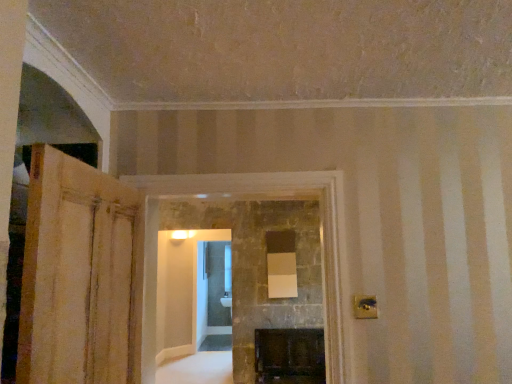
What is the approximate width of wooden door at left?

The width of wooden door at left is 3.49 inches.

I want to click on wooden door at left, so click(x=78, y=274).

Image resolution: width=512 pixels, height=384 pixels. What do you see at coordinates (78, 274) in the screenshot?
I see `wooden door at left` at bounding box center [78, 274].

This screenshot has height=384, width=512. Describe the element at coordinates (280, 199) in the screenshot. I see `dark stone fireplace at center` at that location.

Locate an element on the screen. dark stone fireplace at center is located at coordinates pos(280,199).

This screenshot has width=512, height=384. In order to click on wooden door at left in this screenshot , I will do `click(78, 274)`.

Considering the positions of objects dark stone fireplace at center and wooden door at left in the image provided, who is more to the left, dark stone fireplace at center or wooden door at left?

Positioned to the left is wooden door at left.

Is dark stone fireplace at center further to camera compared to wooden door at left?

Yes, the depth of dark stone fireplace at center is greater than that of wooden door at left.

Which is behind, point (341, 331) or point (115, 328)?

Point (341, 331)

From the image's perspective, between dark stone fireplace at center and wooden door at left, who is located below?

dark stone fireplace at center, from the image's perspective.

From a real-world perspective, is dark stone fireplace at center positioned above or below wooden door at left?

Clearly, from a real-world perspective, dark stone fireplace at center is above wooden door at left.

Which object is wider, dark stone fireplace at center or wooden door at left?

With larger width is dark stone fireplace at center.

Can you confirm if dark stone fireplace at center is shorter than wooden door at left?

Incorrect, the height of dark stone fireplace at center does not fall short of that of wooden door at left.

Based on the photo, who is smaller, dark stone fireplace at center or wooden door at left?

wooden door at left is smaller.

Is wooden door at left a part of dark stone fireplace at center?

No, wooden door at left is not a part of dark stone fireplace at center.

Is dark stone fireplace at center not near wooden door at left?

That's not correct — dark stone fireplace at center is a little close to wooden door at left.

Is dark stone fireplace at center facing away from wooden door at left?

No, wooden door at left is not at the back of dark stone fireplace at center.

What's the angular difference between dark stone fireplace at center and wooden door at left's facing directions?

There is a 86.1-degree angle between the facing directions of dark stone fireplace at center and wooden door at left.

Measure the distance between dark stone fireplace at center and wooden door at left.

The distance of dark stone fireplace at center from wooden door at left is 24.10 inches.

The width and height of the screenshot is (512, 384). Find the location of `door in front of the dark stone fireplace at center`. door in front of the dark stone fireplace at center is located at coordinates (78, 274).

Considering the relative positions of wooden door at left and dark stone fireplace at center in the image provided, is wooden door at left to the left of dark stone fireplace at center from the viewer's perspective?

Yes, wooden door at left is to the left of dark stone fireplace at center.

Based on the photo, is wooden door at left further to the viewer compared to dark stone fireplace at center?

No, it is not.

Considering the points (104, 229) and (330, 370), which point is in front, point (104, 229) or point (330, 370)?

Point (104, 229)

From the image's perspective, who appears lower, wooden door at left or dark stone fireplace at center?

dark stone fireplace at center is shown below in the image.

From a real-world perspective, is wooden door at left on dark stone fireplace at center?

No, from a real-world perspective, wooden door at left is not over dark stone fireplace at center

Does wooden door at left have a lesser width compared to dark stone fireplace at center?

→ Yes, wooden door at left is thinner than dark stone fireplace at center.

Does wooden door at left have a greater height compared to dark stone fireplace at center?

No.

Does wooden door at left have a smaller size compared to dark stone fireplace at center?

Correct, wooden door at left occupies less space than dark stone fireplace at center.

Based on the photo, is wooden door at left spatially inside dark stone fireplace at center, or outside of it?

The correct answer is: outside.

Are wooden door at left and dark stone fireplace at center beside each other?

There is a gap between wooden door at left and dark stone fireplace at center.

Is wooden door at left positioned with its back to dark stone fireplace at center?

No, wooden door at left's orientation is not away from dark stone fireplace at center.

How far apart are wooden door at left and dark stone fireplace at center?

wooden door at left and dark stone fireplace at center are 24.10 inches apart.

What are the coordinates of `fireplace behind the wooden door at left` in the screenshot? It's located at (280, 199).

Where is `door below the dark stone fireplace at center (from a real-world perspective)`? The width and height of the screenshot is (512, 384). door below the dark stone fireplace at center (from a real-world perspective) is located at coordinates (78, 274).

This screenshot has width=512, height=384. I want to click on door on the left side of dark stone fireplace at center, so (78, 274).